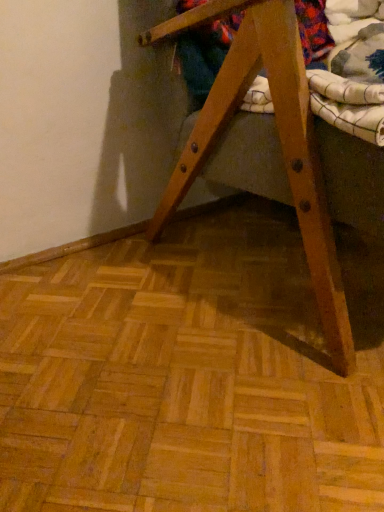
The width and height of the screenshot is (384, 512). What do you see at coordinates (313, 30) in the screenshot? I see `floral fabric at upper right` at bounding box center [313, 30].

Measure the distance between point (320, 46) and camera.

Point (320, 46) and camera are 36.89 inches apart from each other.

What are the coordinates of `floral fabric at upper right` in the screenshot? It's located at (313, 30).

Find the location of a particular element. This screenshot has width=384, height=512. wooden folding chair at center is located at coordinates (279, 138).

This screenshot has width=384, height=512. What do you see at coordinates (279, 138) in the screenshot?
I see `wooden folding chair at center` at bounding box center [279, 138].

What is the approximate width of wooden folding chair at center?

25.86 inches.

Identify the location of floral fabric at upper right. Image resolution: width=384 pixels, height=512 pixels. pyautogui.click(x=313, y=30).

Is wooden folding chair at center to the right of floral fabric at upper right from the viewer's perspective?

Indeed, wooden folding chair at center is positioned on the right side of floral fabric at upper right.

Is wooden folding chair at center in front of or behind floral fabric at upper right in the image?

Visually, wooden folding chair at center is located in front of floral fabric at upper right.

Is point (290, 64) closer or farther from the camera than point (207, 32)?

Point (290, 64).

Consider the image. From the image's perspective, is wooden folding chair at center above or below floral fabric at upper right?

From the image's perspective, wooden folding chair at center appears below floral fabric at upper right.

From a real-world perspective, is wooden folding chair at center physically below floral fabric at upper right?

Correct, in the physical world, wooden folding chair at center is lower than floral fabric at upper right.

Considering the sizes of objects wooden folding chair at center and floral fabric at upper right in the image provided, who is thinner, wooden folding chair at center or floral fabric at upper right?

Thinner between the two is floral fabric at upper right.

Considering the relative sizes of wooden folding chair at center and floral fabric at upper right in the image provided, is wooden folding chair at center shorter than floral fabric at upper right?

No.

Which of these two, wooden folding chair at center or floral fabric at upper right, is bigger?

With larger size is wooden folding chair at center.

Would you say wooden folding chair at center contains floral fabric at upper right?

Yes, wooden folding chair at center contains floral fabric at upper right.

Is wooden folding chair at center far from floral fabric at upper right?

No, wooden folding chair at center is not far from floral fabric at upper right.

Is wooden folding chair at center turned away from floral fabric at upper right?

Yes, wooden folding chair at center is positioned with its back facing floral fabric at upper right.

How many degrees apart are the facing directions of wooden folding chair at center and floral fabric at upper right?

4.07 degrees.

This screenshot has height=512, width=384. Find the location of `furniture below the floral fabric at upper right (from the image's perspective)`. furniture below the floral fabric at upper right (from the image's perspective) is located at coordinates (279, 138).

Which is more to the right, floral fabric at upper right or wooden folding chair at center?

Positioned to the right is wooden folding chair at center.

In the image, is floral fabric at upper right positioned in front of or behind wooden folding chair at center?

Visually, floral fabric at upper right is located behind wooden folding chair at center.

Between point (180, 9) and point (259, 38), which one is positioned in front?

The point (259, 38) is in front.

Consider the image. From the image's perspective, which is above, floral fabric at upper right or wooden folding chair at center?

floral fabric at upper right appears higher in the image.

From a real-world perspective, is floral fabric at upper right positioned over wooden folding chair at center based on gravity?

Indeed, from a real-world perspective, floral fabric at upper right stands above wooden folding chair at center.

Considering the relative sizes of floral fabric at upper right and wooden folding chair at center in the image provided, is floral fabric at upper right thinner than wooden folding chair at center?

Yes, floral fabric at upper right is thinner than wooden folding chair at center.

Is floral fabric at upper right taller or shorter than wooden folding chair at center?

A: Clearly, floral fabric at upper right is shorter compared to wooden folding chair at center.

Does floral fabric at upper right have a smaller size compared to wooden folding chair at center?

Indeed, floral fabric at upper right has a smaller size compared to wooden folding chair at center.

Is wooden folding chair at center surrounded by floral fabric at upper right?

No.

Is floral fabric at upper right far from wooden folding chair at center?

No, floral fabric at upper right is in close proximity to wooden folding chair at center.

Could you tell me if floral fabric at upper right is facing wooden folding chair at center?

Yes, floral fabric at upper right is turned towards wooden folding chair at center.

How many degrees apart are the facing directions of floral fabric at upper right and wooden folding chair at center?

4.07 degrees separate the facing orientations of floral fabric at upper right and wooden folding chair at center.

Image resolution: width=384 pixels, height=512 pixels. In the image, there is a floral fabric at upper right. In order to click on furniture below it (from a real-world perspective) in this screenshot , I will do `click(279, 138)`.

This screenshot has width=384, height=512. In order to click on furniture in front of the floral fabric at upper right in this screenshot , I will do `click(279, 138)`.

At what (x,y) coordinates should I click in order to perform the action: click on underclothes lying behind the wooden folding chair at center. Please return your answer as a coordinate pair (x, y). The image size is (384, 512). Looking at the image, I should click on (313, 30).